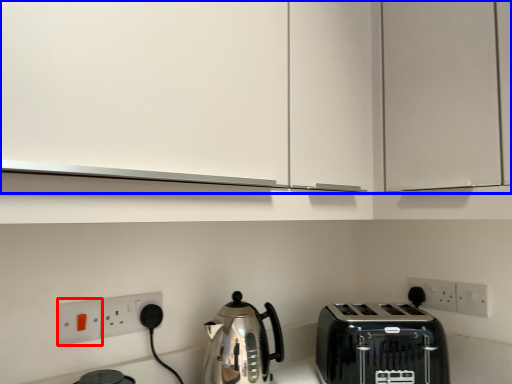
Question: Which point is further to the camera, electric outlet (highlighted by a red box) or cabinetry (highlighted by a blue box)?

Choices:
 (A) electric outlet
 (B) cabinetry

Answer: (A)